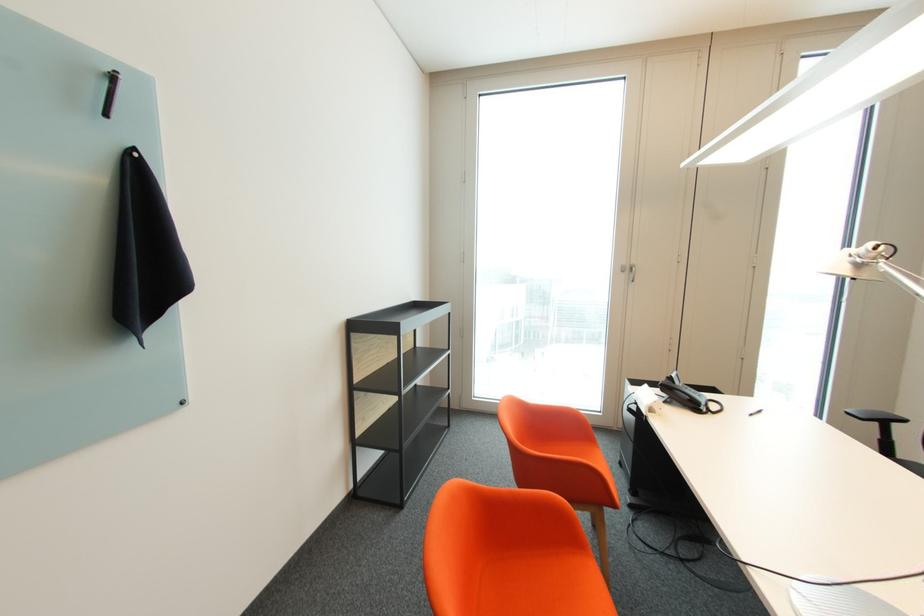
The image size is (924, 616). Find the location of `desk lamp head`. desk lamp head is located at coordinates (857, 261).